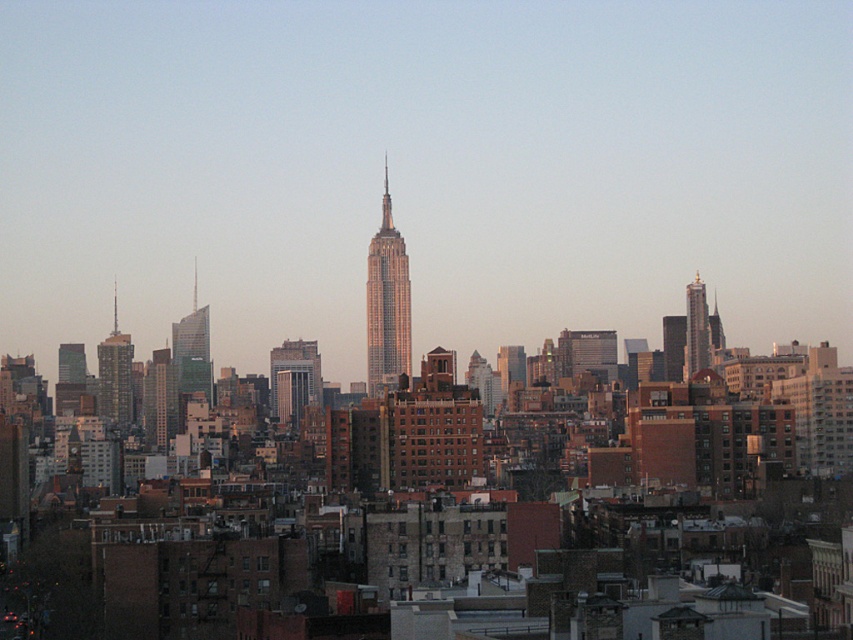
Question: Which object appears closest to the camera in this image?

Choices:
 (A) gold reflective skyscraper at right
 (B) green glass skyscraper at left
 (C) shiny glass skyscraper at center

Answer: (C)

Question: Can you confirm if metallic glass skyscraper at left is wider than green glass skyscraper at left?

Choices:
 (A) no
 (B) yes

Answer: (A)

Question: Does green glass skyscraper at left appear under gold reflective skyscraper at right?

Choices:
 (A) yes
 (B) no

Answer: (A)

Question: Which point appears farthest from the camera in this image?

Choices:
 (A) (207, 353)
 (B) (106, 342)
 (C) (403, 241)

Answer: (B)

Question: Is metallic glass skyscraper at left to the left of green glass skyscraper at left from the viewer's perspective?

Choices:
 (A) yes
 (B) no

Answer: (A)

Question: Which point is closer to the camera?

Choices:
 (A) gold reflective skyscraper at right
 (B) green glass skyscraper at left

Answer: (B)